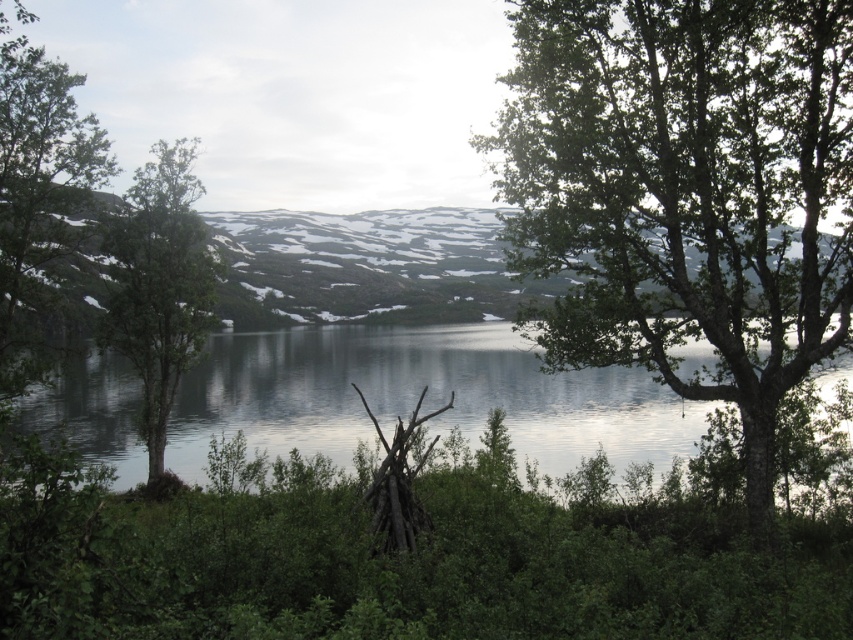
Question: Which is farther from the green leafy tree at left?

Choices:
 (A) green leafy tree at upper right
 (B) snowy rock mountain at center

Answer: (B)

Question: Does snowy rock mountain at center appear over green leafy tree at left?

Choices:
 (A) no
 (B) yes

Answer: (B)

Question: Does clear water at center appear under snowy rock mountain at center?

Choices:
 (A) yes
 (B) no

Answer: (A)

Question: Which is farther from the green leafy tree at upper right?

Choices:
 (A) snowy rock mountain at center
 (B) clear water at center
 (C) green leafy tree at left

Answer: (A)

Question: Can you confirm if clear water at center is thinner than snowy rock mountain at center?

Choices:
 (A) no
 (B) yes

Answer: (B)

Question: Which point is closer to the camera?

Choices:
 (A) (598, 173)
 (B) (190, 280)
 (C) (309, 288)

Answer: (A)